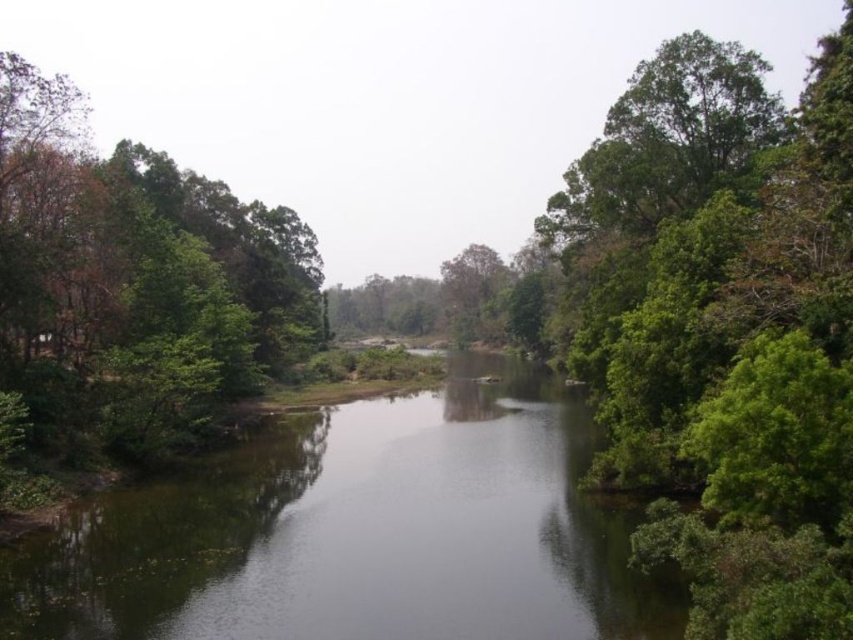
You are standing at the edge of the river and want to take a photo of the green leafy tree at left without the green reflective water at center blocking the view. Is this possible?

The green reflective water at center is in front of the green leafy tree at left, so it would block the view. Move to a position where the tree is not behind the water, or adjust your angle to avoid the water reflection.

You are standing on the riverbank and want to take a photo of the green leafy tree at right and the green reflective water at center. Which object will appear bigger in the photo?

The green leafy tree at right will appear bigger in the photo because it has a larger size compared to the green reflective water at center.

You are standing at the point with coordinates point (62, 360) and want to reach the point with coordinates point (465, 456). Based on the scene description, which direction should you move to get there?

Since point (465, 456) is behind point (62, 360), you should move backward to reach it.